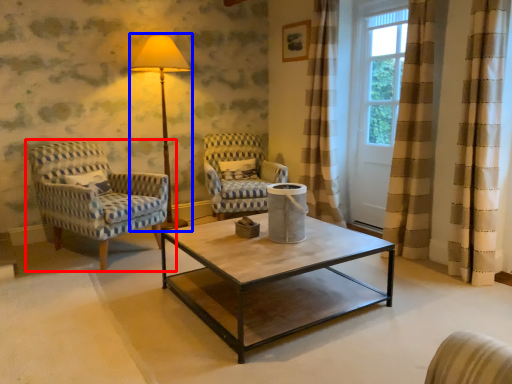
Question: Which point is further to the camera, chair (highlighted by a red box) or table lamp (highlighted by a blue box)?

Choices:
 (A) chair
 (B) table lamp

Answer: (B)